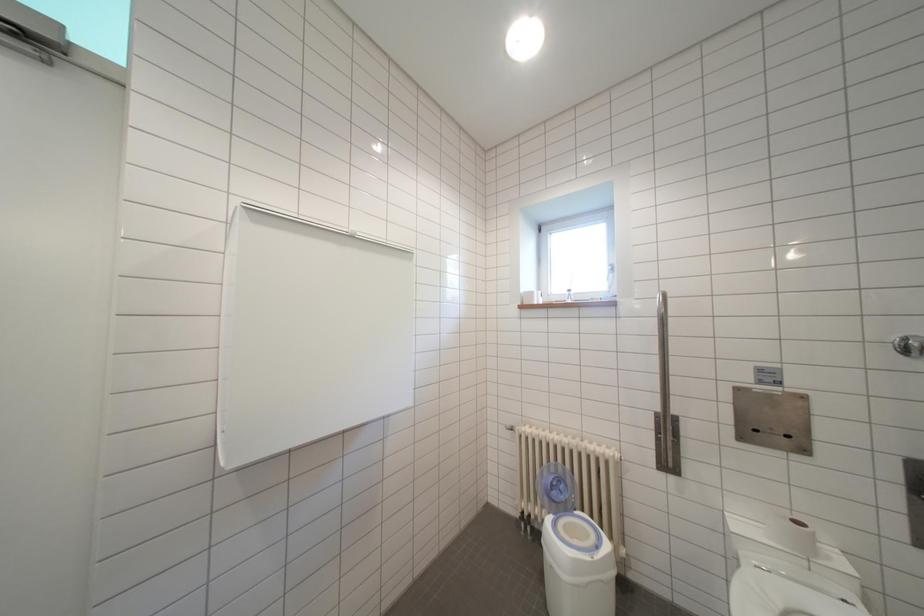
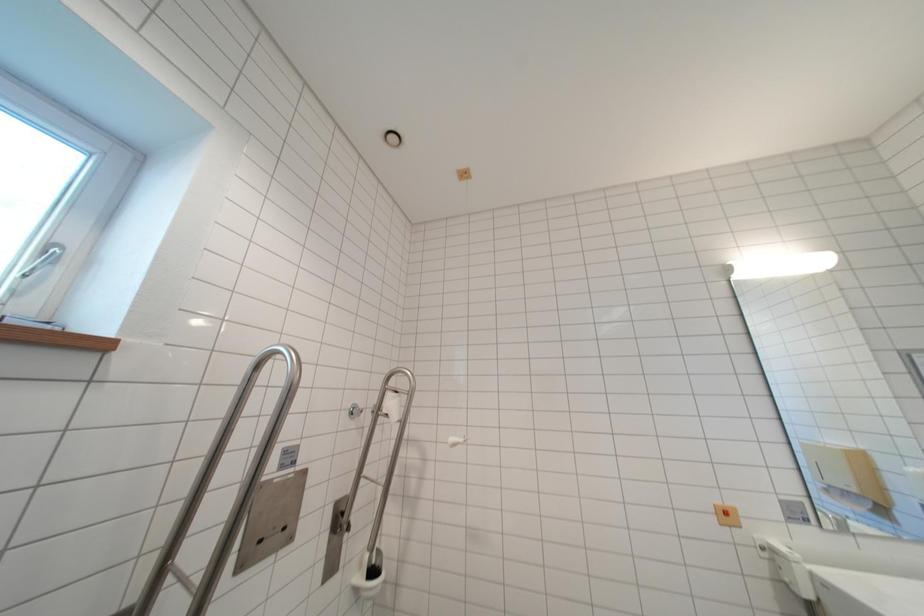
Based on the continuous images, in which direction is the camera rotating?

The camera rotated toward right-up.